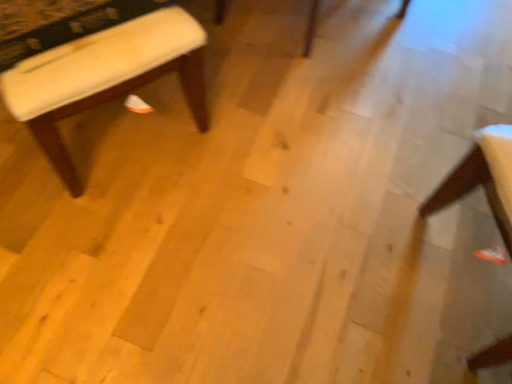
You are a GUI agent. You are given a task and a screenshot of the screen. Output one action in this format:
    pyautogui.click(x=<x>, y=<y>)
    Task: Click on the free space in front of white fabric stool at left
    
    Given the screenshot: What is the action you would take?
    coord(55,224)